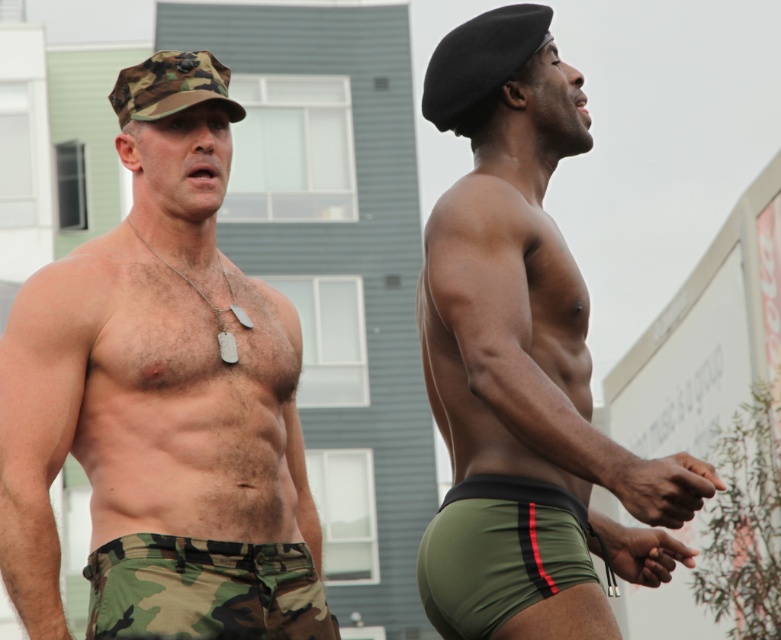
Is camo fabric shorts at left shorter than camo fabric shorts at lower left?

Incorrect, camo fabric shorts at left's height does not fall short of camo fabric shorts at lower left's.

At what (x,y) coordinates should I click in order to perform the action: click on camo fabric shorts at left. Please return your answer as a coordinate pair (x, y). Image resolution: width=781 pixels, height=640 pixels. Looking at the image, I should click on (161, 401).

Where is `camo fabric shorts at left`? camo fabric shorts at left is located at coordinates (161, 401).

Which is in front, point (23, 595) or point (521, 429)?

Point (521, 429) is more forward.

Consider the image. Between camo fabric shorts at left and olive green spandex briefs at right, which one appears on the left side from the viewer's perspective?

Positioned to the left is camo fabric shorts at left.

In order to click on camo fabric shorts at left in this screenshot , I will do `click(161, 401)`.

Does camo fabric shorts at lower left appear on the right side of olive green fabric shorts at lower right?

Incorrect, camo fabric shorts at lower left is not on the right side of olive green fabric shorts at lower right.

Who is shorter, camo fabric shorts at lower left or olive green fabric shorts at lower right?

camo fabric shorts at lower left is shorter.

This screenshot has height=640, width=781. What do you see at coordinates (204, 589) in the screenshot?
I see `camo fabric shorts at lower left` at bounding box center [204, 589].

Where is `camo fabric shorts at lower left`? camo fabric shorts at lower left is located at coordinates (204, 589).